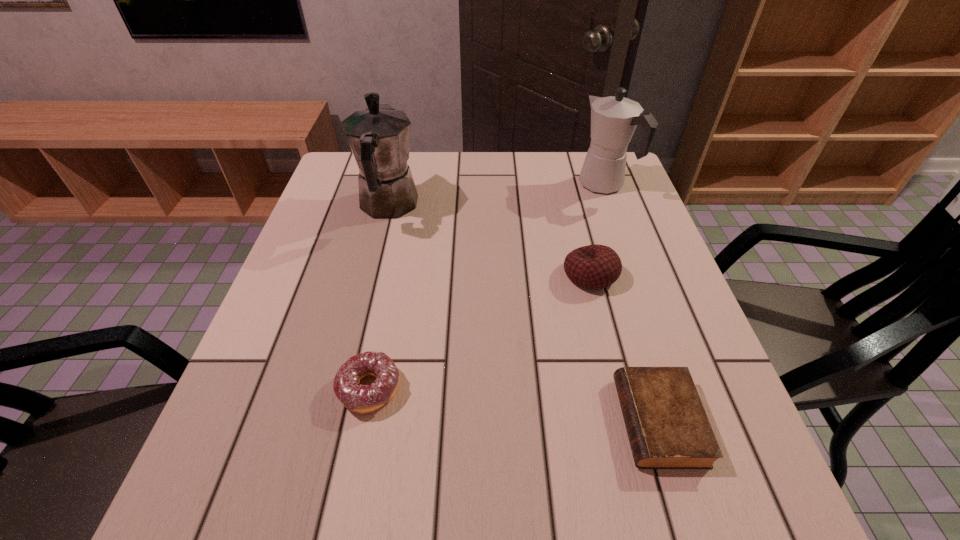
In order to click on the left coffeepot in this screenshot , I will do `click(379, 137)`.

Where is `the right coffeepot`? The width and height of the screenshot is (960, 540). the right coffeepot is located at coordinates (613, 119).

Where is `beanbag`? Image resolution: width=960 pixels, height=540 pixels. beanbag is located at coordinates (595, 266).

Identify the location of the third shortest object. The width and height of the screenshot is (960, 540). (595, 266).

The width and height of the screenshot is (960, 540). I want to click on the second shortest object, so point(358,398).

Image resolution: width=960 pixels, height=540 pixels. I want to click on diary, so click(x=667, y=426).

Find the location of a particular element. vacant space situated 0.100m on the pouring side of the left coffeepot is located at coordinates (399, 161).

The width and height of the screenshot is (960, 540). I want to click on blank space located on the pouring side of the left coffeepot, so click(x=400, y=158).

Locate an element on the screen. vacant position located 0.080m on the pouring side of the left coffeepot is located at coordinates (x=398, y=165).

I want to click on free region located 0.400m on the left of the right coffeepot, so click(438, 185).